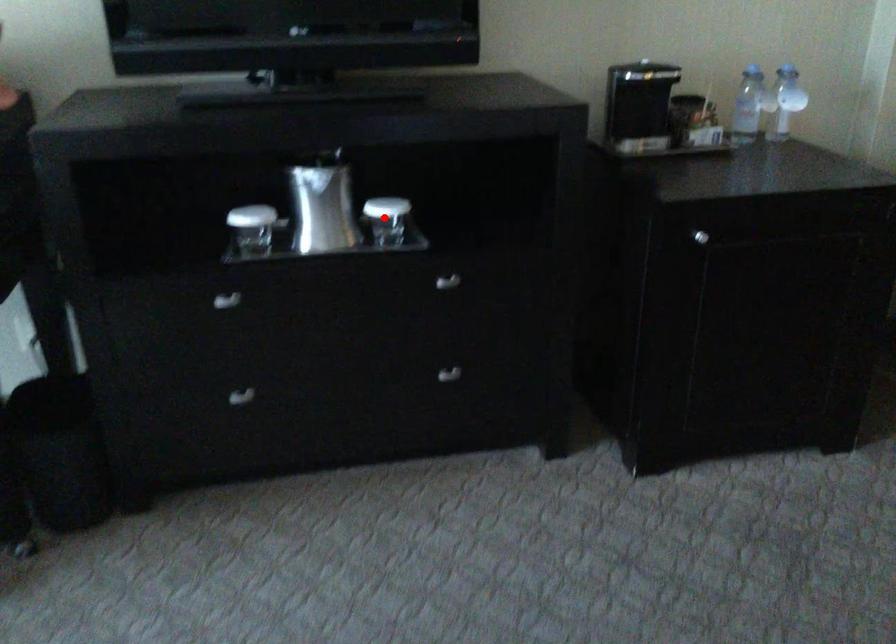
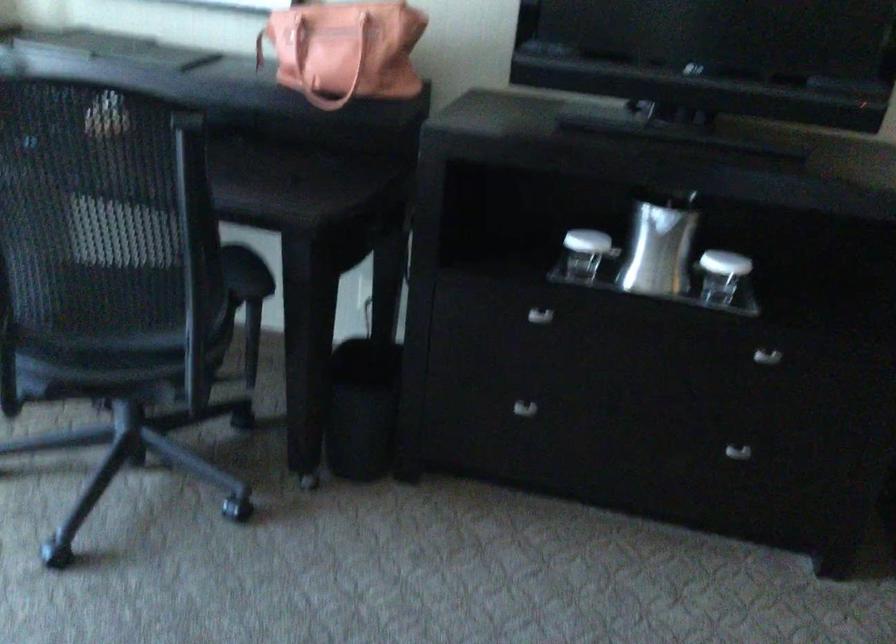
Where in the second image is the point corresponding to the highlighted location from the first image?

(721, 275)